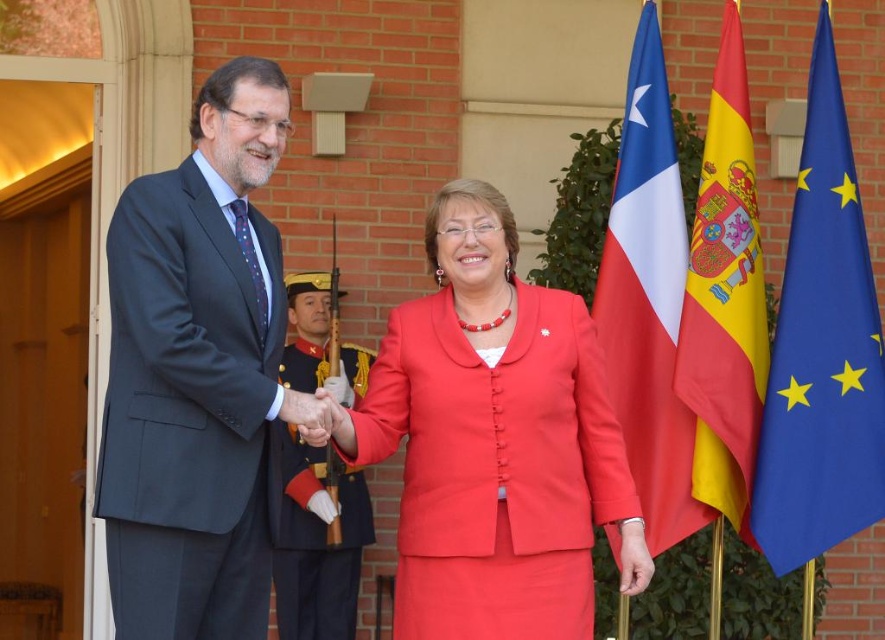
Question: Can you confirm if blue fabric flag at right is wider than yellow fabric flag at right?

Choices:
 (A) yes
 (B) no

Answer: (A)

Question: Among these objects, which one is nearest to the camera?

Choices:
 (A) matte red suit at center
 (B) dark blue woolen suit at center
 (C) blue fabric flag at right
 (D) smooth skin hand at center

Answer: (D)

Question: Which object appears farthest from the camera in this image?

Choices:
 (A) dark blue woolen suit at center
 (B) yellow fabric flag at right

Answer: (A)

Question: Is white fabric flag at right above smooth skin hand at center?

Choices:
 (A) no
 (B) yes

Answer: (B)

Question: Does matte black suit at left have a smaller size compared to matte red suit at center?

Choices:
 (A) no
 (B) yes

Answer: (B)

Question: Which object is farther from the camera taking this photo?

Choices:
 (A) matte black suit at left
 (B) dark blue woolen suit at center
 (C) matte red suit at center

Answer: (B)